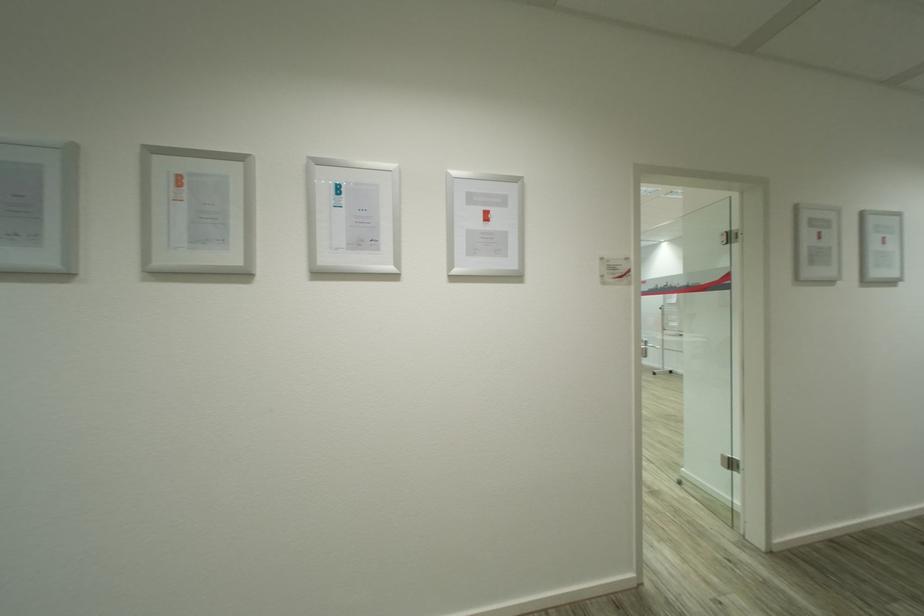
At what (x,y) coordinates should I click in order to perform the action: click on metal door handle. Please return your answer as a coordinate pair (x, y). The height and width of the screenshot is (616, 924). Looking at the image, I should click on (647, 347).